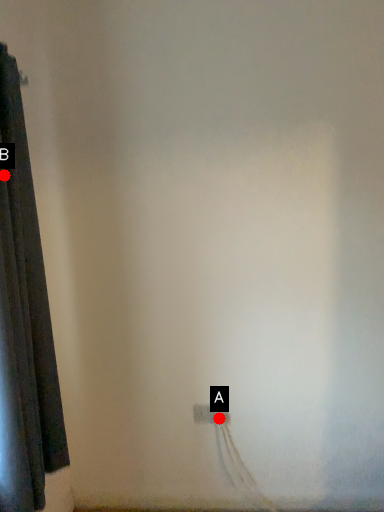
Question: Two points are circled on the image, labeled by A and B beside each circle. Which of the following is the farthest from the observer?

Choices:
 (A) A is further
 (B) B is further

Answer: (A)